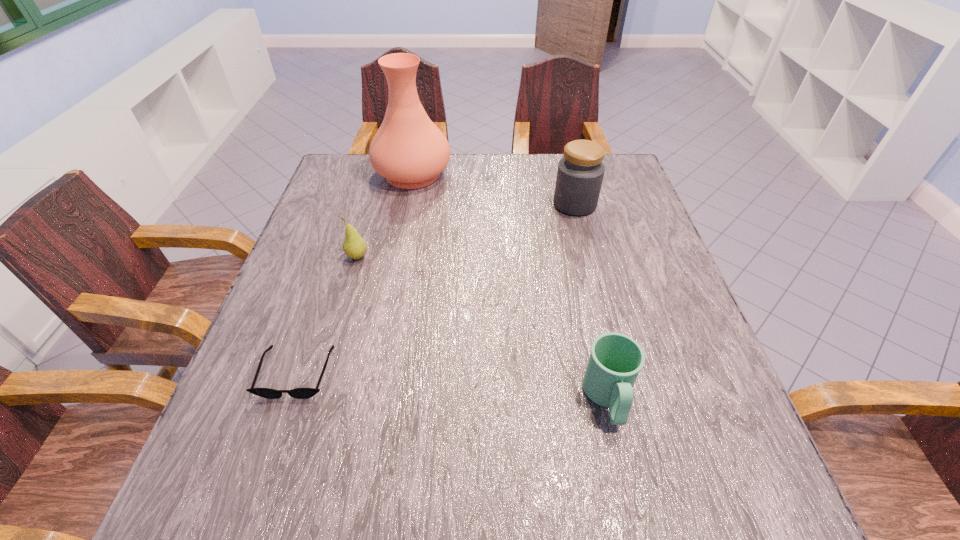
The width and height of the screenshot is (960, 540). I want to click on free space that satisfies the following two spatial constraints: 1. on the surface of the second tallest object near the warning symbol; 2. on the front side of the pear, so click(588, 257).

At what (x,y) coordinates should I click in order to perform the action: click on blank space that satisfies the following two spatial constraints: 1. on the surface of the fourth shortest object near the warning symbol; 2. on the front side of the third nearest object. Please return your answer as a coordinate pair (x, y). The width and height of the screenshot is (960, 540). Looking at the image, I should click on (588, 257).

In order to click on vacant area that satisfies the following two spatial constraints: 1. on the surface of the jar near the warning symbol; 2. on the side of the mug with the handle in this screenshot , I will do `click(624, 399)`.

Where is `free region that satisfies the following two spatial constraints: 1. on the surface of the fourth shortest object near the warning symbol; 2. on the front-facing side of the shortest object`? The height and width of the screenshot is (540, 960). free region that satisfies the following two spatial constraints: 1. on the surface of the fourth shortest object near the warning symbol; 2. on the front-facing side of the shortest object is located at coordinates (618, 373).

Find the location of a particular element. Image resolution: width=960 pixels, height=540 pixels. vacant region that satisfies the following two spatial constraints: 1. on the surface of the second tallest object near the warning symbol; 2. on the front-facing side of the shortest object is located at coordinates (618, 373).